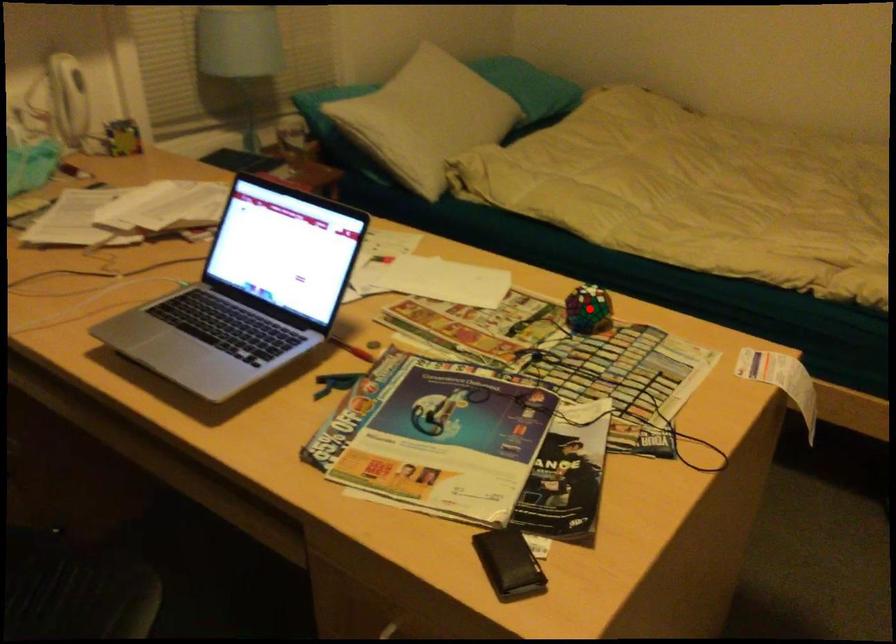
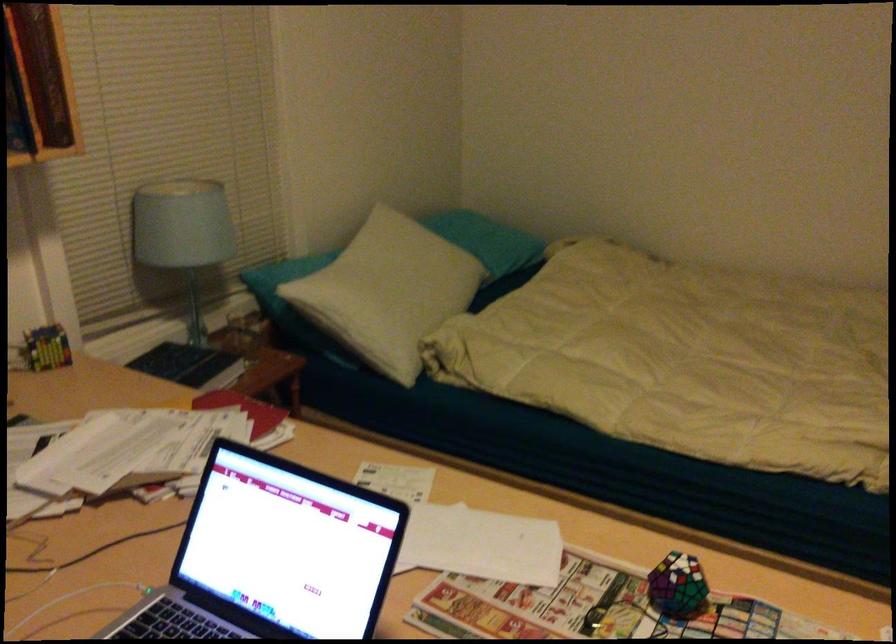
Question: I am providing you with two images of the same scene from different viewpoints. Given a red point in image1, look at the same physical point in image2. Is it:

Choices:
 (A) Closer to the viewpoint
 (B) Farther from the viewpoint

Answer: (A)